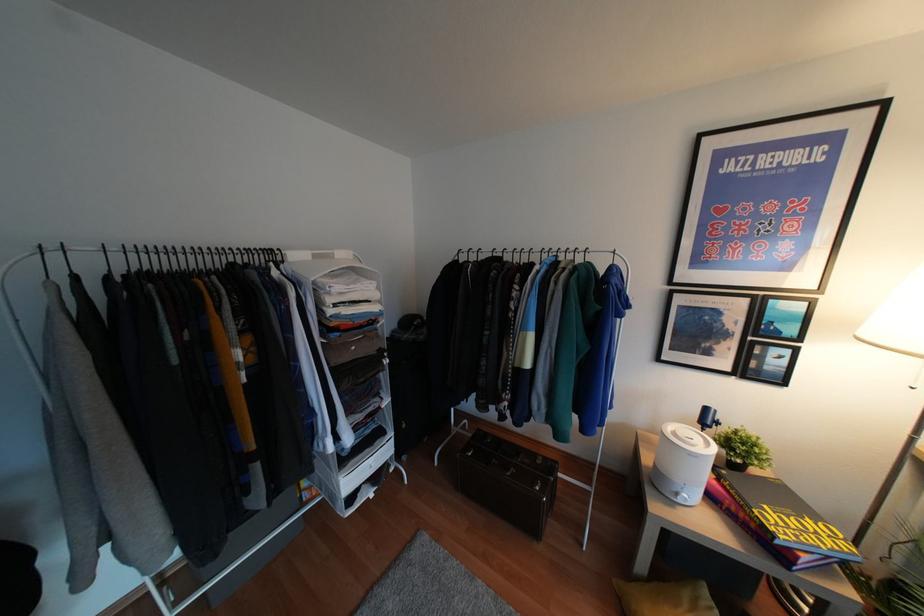
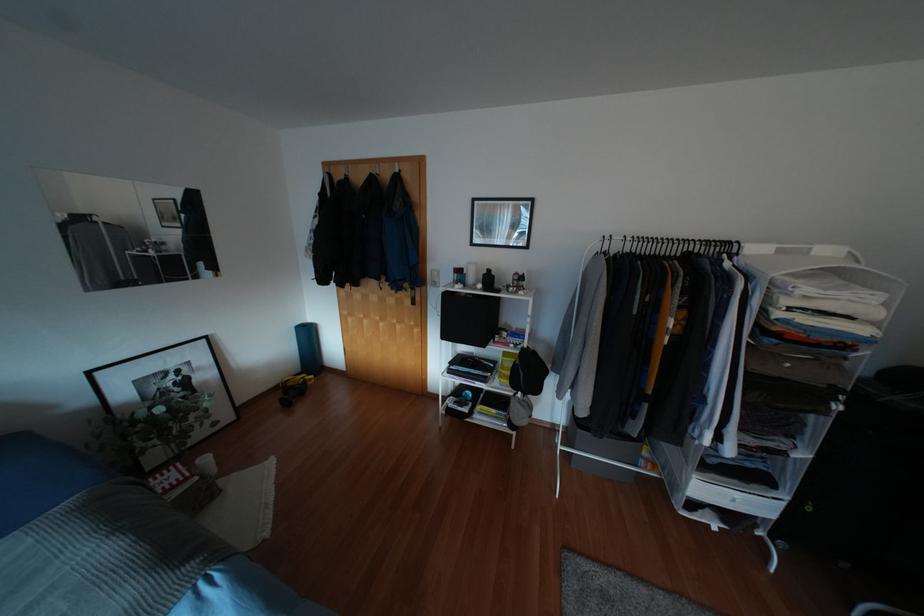
Question: The camera is either moving clockwise (left) or counter-clockwise (right) around the object. The first image is from the beginning of the video and the second image is from the end. Is the camera moving left or right when shooting the video?

Choices:
 (A) Left
 (B) Right

Answer: (B)